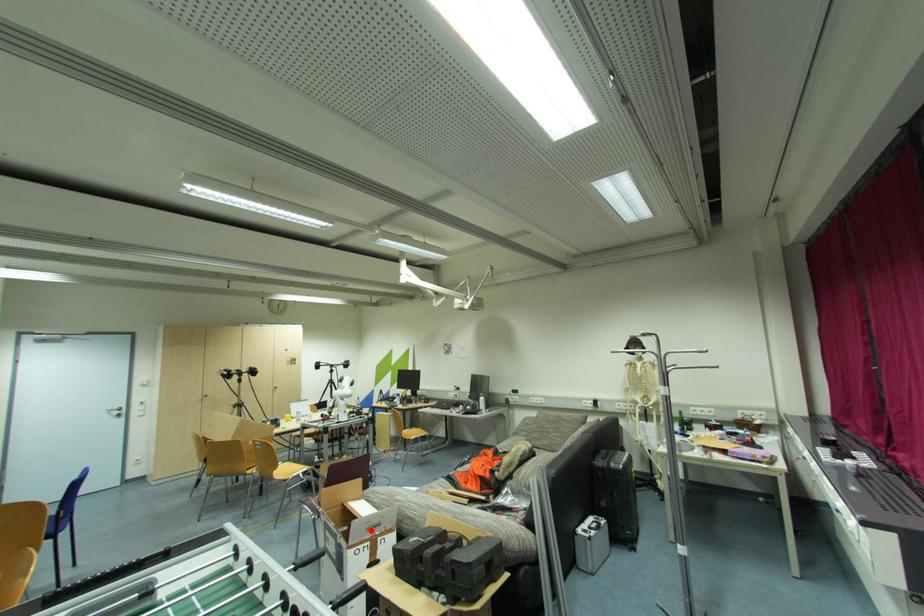
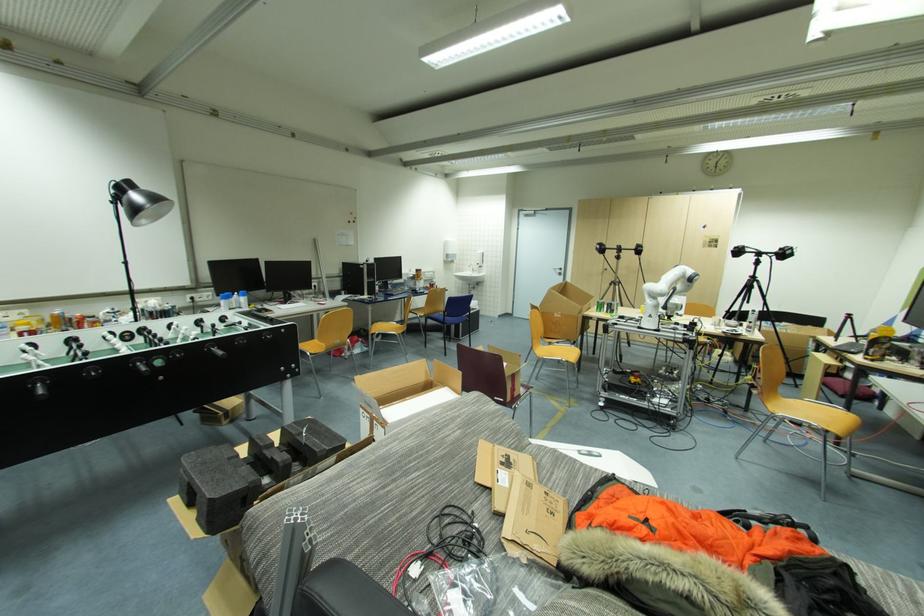
Where in the second image is the point corresponding to the highlighted location from the first image?

(369, 403)